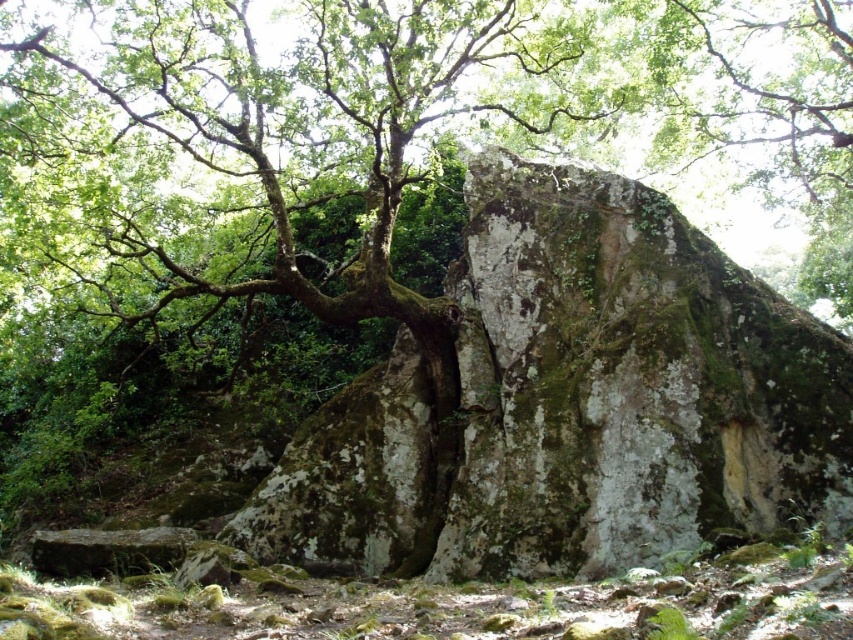
You are a hiker standing at the base of both the green mossy tree at center and the green mossy rock at center. Which object would you need to look up more to see the top of?

The green mossy tree at center is much taller than the green mossy rock at center, so you would need to look up more to see the top of the green mossy tree at center.